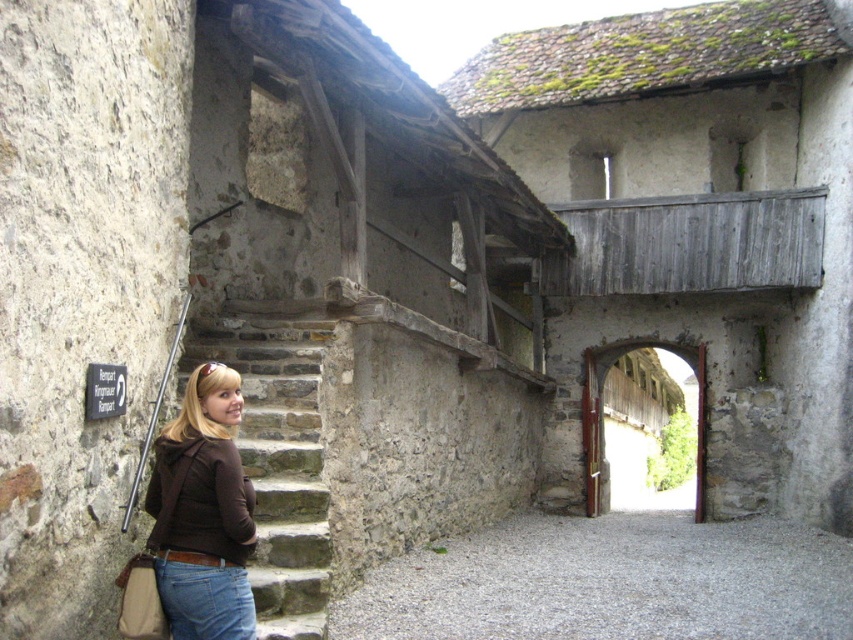
Question: In this image, where is jeans at lower left located relative to wooden gate at center?

Choices:
 (A) below
 (B) above

Answer: (B)

Question: Estimate the real-world distances between objects in this image. Which object is farther from the wooden gate at center?

Choices:
 (A) jeans at lower left
 (B) gray gravel alley at center

Answer: (A)

Question: Which object is positioned farthest from the gray gravel alley at center?

Choices:
 (A) brown matte jacket at lower left
 (B) wooden gate at center
 (C) stone stairs at left
 (D) jeans at lower left

Answer: (B)

Question: Which object is the closest to the gray gravel alley at center?

Choices:
 (A) wooden gate at center
 (B) jeans at lower left

Answer: (B)

Question: Is gray gravel alley at center above stone stairs at left?

Choices:
 (A) yes
 (B) no

Answer: (B)

Question: Does brown matte jacket at lower left have a greater width compared to wooden gate at center?

Choices:
 (A) no
 (B) yes

Answer: (A)